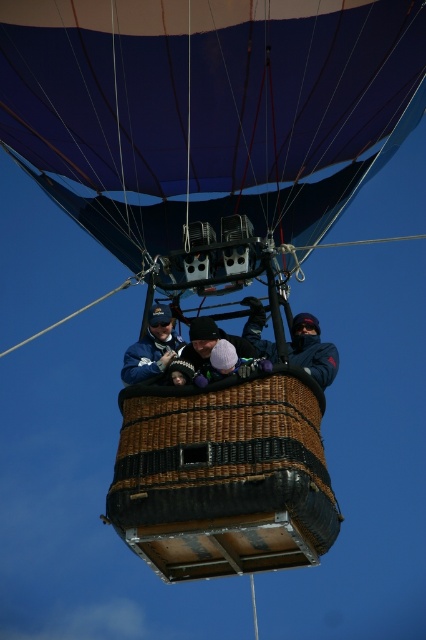
Between dark blue fabric at upper center and blue fabric jacket at center, which one has more height?

With more height is dark blue fabric at upper center.

Which is above, dark blue fabric at upper center or blue fabric jacket at center?

blue fabric jacket at center is higher up.

I want to click on dark blue fabric at upper center, so click(x=311, y=349).

Identify the location of dark blue fabric at upper center. This screenshot has width=426, height=640. (311, 349).

Who is positioned more to the right, matte blue jacket at center or white knit hat at center?

matte blue jacket at center is more to the right.

Does matte blue jacket at center have a larger size compared to white knit hat at center?

Yes, matte blue jacket at center is bigger than white knit hat at center.

Is point (313, 321) positioned in front of point (192, 342)?

No, it is behind (192, 342).

The image size is (426, 640). I want to click on matte blue jacket at center, so [313, 353].

Measure the distance between matte blue jacket at center and camera.

A distance of 86.98 meters exists between matte blue jacket at center and camera.

Is matte blue jacket at center bigger than dark blue fabric at upper center?

Correct, matte blue jacket at center is larger in size than dark blue fabric at upper center.

The width and height of the screenshot is (426, 640). In order to click on matte blue jacket at center in this screenshot , I will do `click(313, 353)`.

Where is `matte blue jacket at center`? matte blue jacket at center is located at coordinates (313, 353).